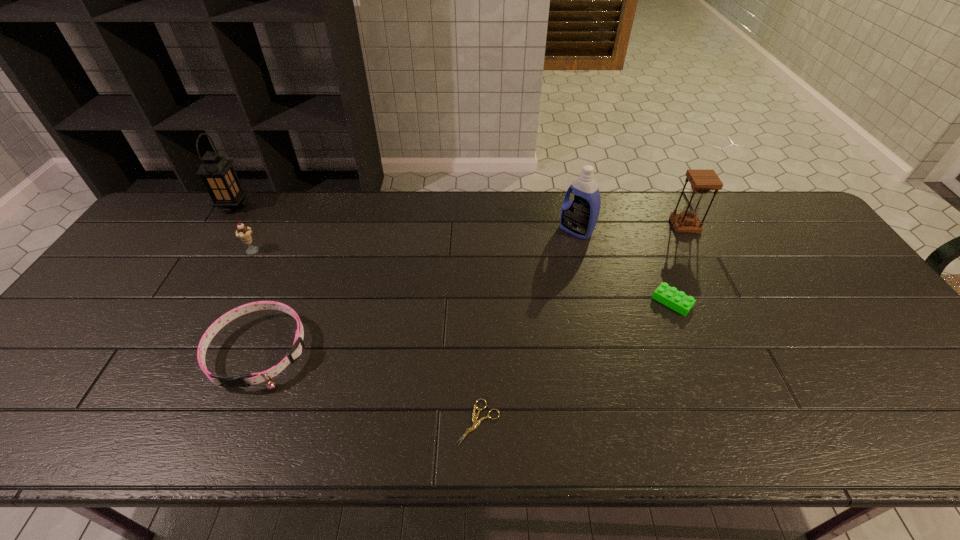
Image resolution: width=960 pixels, height=540 pixels. Identify the location of vacant area that lies between the detergent and the farthest object. (405, 218).

This screenshot has width=960, height=540. I want to click on free space between the fifth tallest object and the shears, so click(369, 387).

I want to click on vacant space in between the sixth object from left to right and the lantern, so click(x=453, y=254).

Where is `vacant space that is in between the fourth shortest object and the shears`? vacant space that is in between the fourth shortest object and the shears is located at coordinates (366, 336).

This screenshot has width=960, height=540. Identify the location of free point between the nearest object and the sixth tallest object. (575, 362).

Identify the location of vacant area between the shears and the fourth nearest object. (366, 336).

You are a GUI agent. You are given a task and a screenshot of the screen. Output one action in this format:
    pyautogui.click(x=<x>, y=<y>)
    Task: Click on the empty space that is in between the dog collar and the rightmost object
    The width and height of the screenshot is (960, 540).
    Given the screenshot: What is the action you would take?
    pyautogui.click(x=472, y=288)

Image resolution: width=960 pixels, height=540 pixels. I want to click on vacant space that is in between the third shortest object and the third object from right to left, so click(x=418, y=291).

Select which object appears as the second closest to the farthest object. Please provide its 2D coordinates. Your answer should be formatted as a tuple, i.e. [(x, y)], where the tuple contains the x and y coordinates of a point satisfying the conditions above.

[(296, 351)]

Point out which object is positioned as the sixth nearest to the shears. Please provide its 2D coordinates. Your answer should be formatted as a tuple, i.e. [(x, y)], where the tuple contains the x and y coordinates of a point satisfying the conditions above.

[(218, 175)]